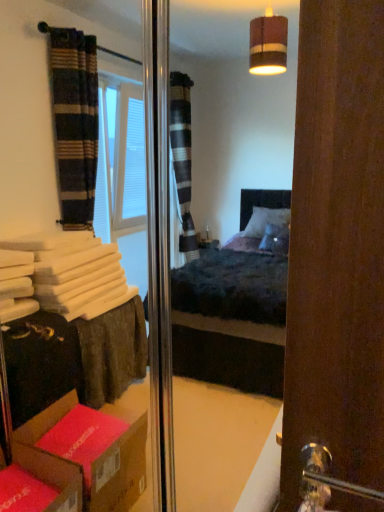
Question: From the image's perspective, is silver metallic door handle at lower right positioned above or below cardboard box at lower left?

Choices:
 (A) below
 (B) above

Answer: (B)

Question: From a real-world perspective, is silver metallic door handle at lower right physically located above or below cardboard box at lower left?

Choices:
 (A) above
 (B) below

Answer: (A)

Question: In terms of width, does silver metallic door handle at lower right look wider or thinner when compared to cardboard box at lower left?

Choices:
 (A) wide
 (B) thin

Answer: (B)

Question: From a real-world perspective, is cardboard box at lower left above or below silver metallic door handle at lower right?

Choices:
 (A) below
 (B) above

Answer: (A)

Question: Considering their positions, is cardboard box at lower left located in front of or behind silver metallic door handle at lower right?

Choices:
 (A) behind
 (B) front

Answer: (A)

Question: Considering the positions of cardboard box at lower left and silver metallic door handle at lower right in the image, is cardboard box at lower left taller or shorter than silver metallic door handle at lower right?

Choices:
 (A) short
 (B) tall

Answer: (A)

Question: Based on their positions, is cardboard box at lower left located to the left or right of silver metallic door handle at lower right?

Choices:
 (A) left
 (B) right

Answer: (A)